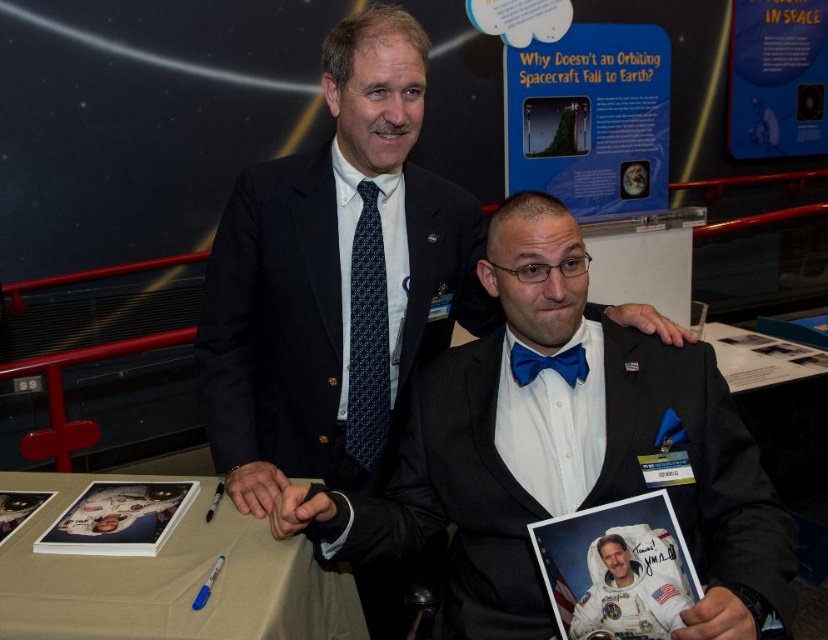
Question: Is black satin business suit at center bigger than matte paper poster at upper center?

Choices:
 (A) no
 (B) yes

Answer: (B)

Question: Based on their relative distances, which object is farther from the black satin suit at center?

Choices:
 (A) blue satin bow tie at center
 (B) black satin business suit at center
 (C) matte paper poster at upper center
 (D) beige fabric table at lower center

Answer: (C)

Question: Estimate the real-world distances between objects in this image. Which object is farther from the blue satin bow tie at center?

Choices:
 (A) black satin suit at center
 (B) black satin business suit at center
 (C) matte paper poster at upper center
 (D) beige fabric table at lower center

Answer: (C)

Question: Does black satin business suit at center come behind blue satin bow tie at center?

Choices:
 (A) yes
 (B) no

Answer: (B)

Question: Which object appears farthest from the camera in this image?

Choices:
 (A) beige fabric table at lower center
 (B) blue satin bow tie at center
 (C) matte paper poster at upper center

Answer: (C)

Question: Does black satin suit at center have a lesser width compared to matte paper poster at upper center?

Choices:
 (A) yes
 (B) no

Answer: (A)